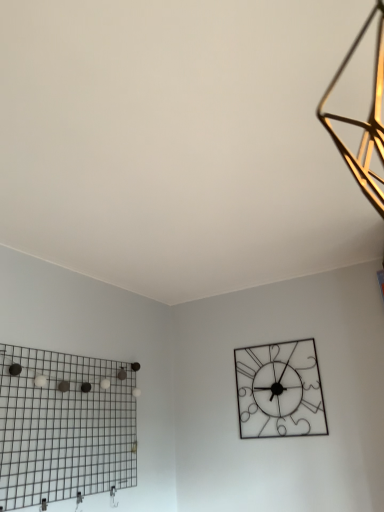
I want to click on metallic wire clock at upper right, so click(x=280, y=390).

What do you see at coordinates (280, 390) in the screenshot?
I see `metallic wire clock at upper right` at bounding box center [280, 390].

At what (x,y) coordinates should I click in order to perform the action: click on metallic wire clock at upper right. Please return your answer as a coordinate pair (x, y). This screenshot has width=384, height=512. Looking at the image, I should click on (280, 390).